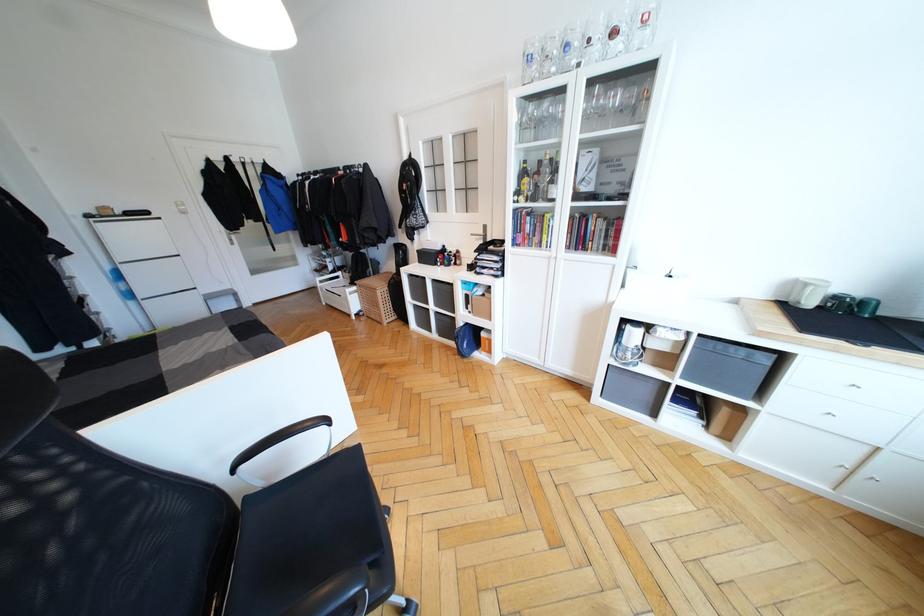
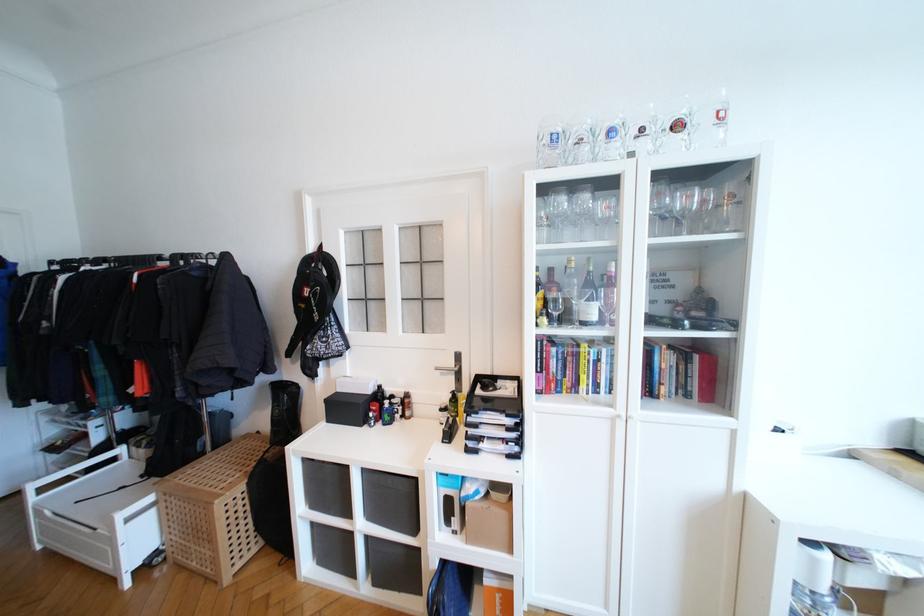
Locate, in the second image, the point that corresponds to point 442,249 in the first image.

(372, 392)